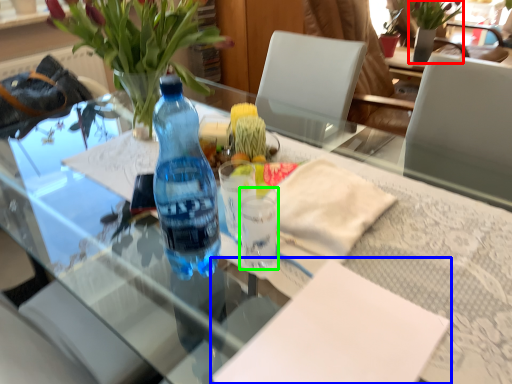
Question: Which object is the farthest from bouquet (highlighted by a red box)? Choose among these: notepad (highlighted by a blue box) or coffee cup (highlighted by a green box).

Choices:
 (A) notepad
 (B) coffee cup

Answer: (A)